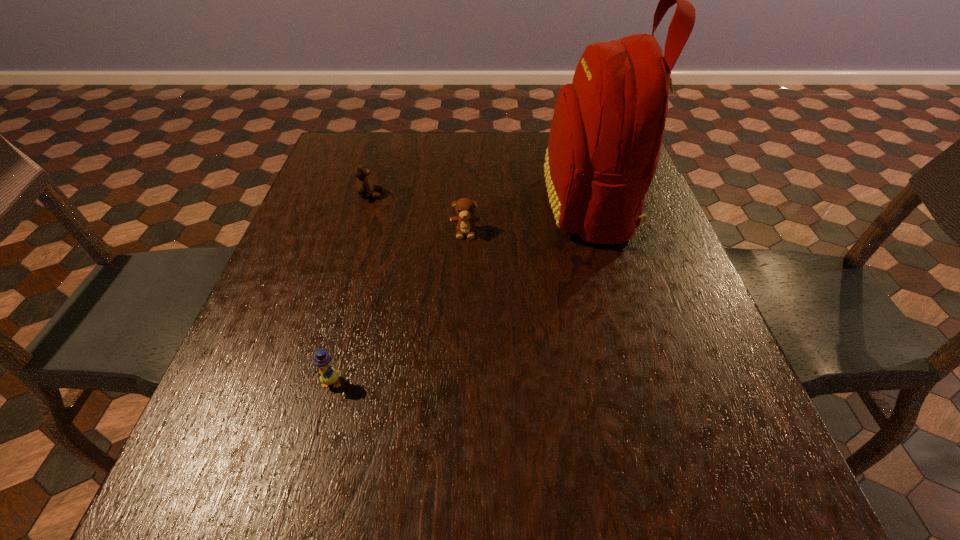
The width and height of the screenshot is (960, 540). I want to click on free space located on the face of the second object from right to left, so click(464, 305).

Image resolution: width=960 pixels, height=540 pixels. Find the location of `free location located on the face of the duckling, where the monocle is placed`. free location located on the face of the duckling, where the monocle is placed is located at coordinates pyautogui.click(x=302, y=488).

Find the location of `object that is at the far edge`. object that is at the far edge is located at coordinates (607, 129).

At what (x,y) coordinates should I click in order to perform the action: click on object located in the left edge section of the desktop. Please return your answer as a coordinate pair (x, y). The height and width of the screenshot is (540, 960). Looking at the image, I should click on (364, 186).

Locate an element on the screen. This screenshot has width=960, height=540. object that is at the right edge is located at coordinates (607, 129).

Locate an element on the screen. object present at the far right corner is located at coordinates (607, 129).

This screenshot has width=960, height=540. In the image, there is a desktop. Find the location of `vacant space at the far edge`. vacant space at the far edge is located at coordinates (477, 162).

Identify the location of free region at the left edge of the desktop. (341, 206).

Find the location of a particular element. vacant area at the right edge of the desktop is located at coordinates (625, 254).

The width and height of the screenshot is (960, 540). Find the location of `free region at the far left corner of the desktop`. free region at the far left corner of the desktop is located at coordinates (320, 176).